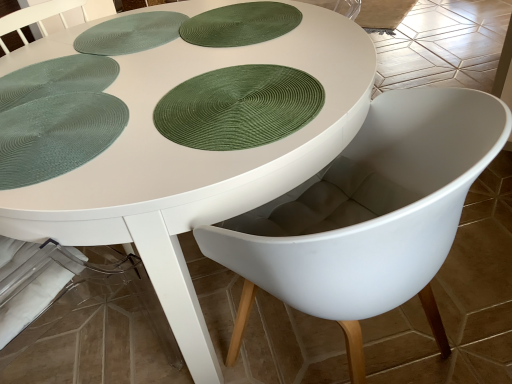
Identify the location of vacant area that lies between green textured placemat at upper left and green woven placemat at center, which is counted as the second paper plate, starting from the bottom. The image size is (512, 384). (169, 71).